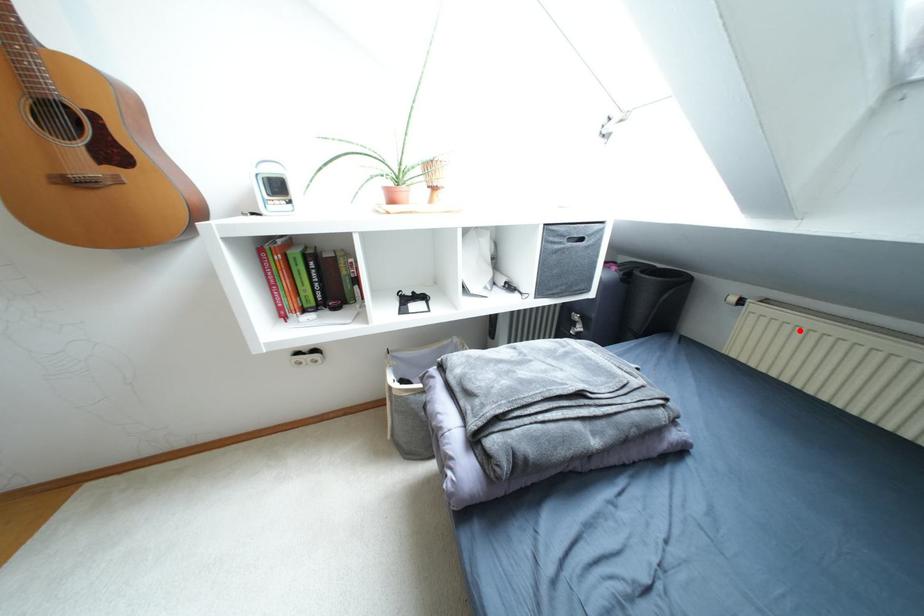
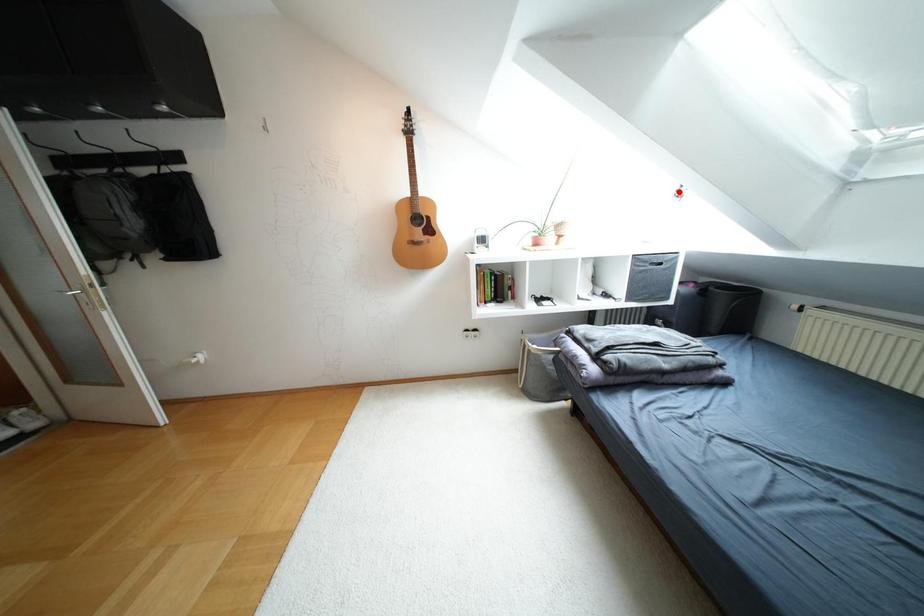
I am providing you with two images of the same scene from different viewpoints. A red point is marked on the first image and another point is marked on the second image. Does the point marked in image1 correspond to the same location as the one in image2?

No